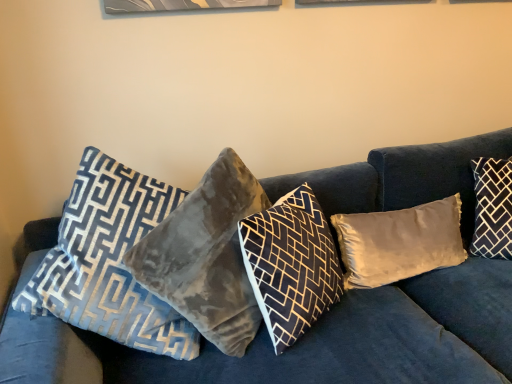
Question: From a real-world perspective, is velvet blue pillow at left, which is the 5th pillow in right-to-left order, physically above satin beige pillow at center, which appears as the fourth pillow when viewed from the left?

Choices:
 (A) no
 (B) yes

Answer: (B)

Question: Does velvet blue pillow at left, which is the 5th pillow in right-to-left order, have a greater height compared to satin beige pillow at center, which is counted as the 2th pillow, starting from the right?

Choices:
 (A) yes
 (B) no

Answer: (A)

Question: Is velvet blue pillow at left, which is the 5th pillow in right-to-left order, looking in the opposite direction of satin beige pillow at center, which is counted as the 2th pillow, starting from the right?

Choices:
 (A) yes
 (B) no

Answer: (B)

Question: Considering the relative positions of velvet blue pillow at left, which is the 5th pillow in right-to-left order, and satin beige pillow at center, which is counted as the 2th pillow, starting from the right, in the image provided, is velvet blue pillow at left, which is the 5th pillow in right-to-left order, to the right of satin beige pillow at center, which is counted as the 2th pillow, starting from the right, from the viewer's perspective?

Choices:
 (A) yes
 (B) no

Answer: (B)

Question: Does velvet blue pillow at left, which appears as the first pillow when viewed from the left, have a smaller size compared to satin beige pillow at center, which appears as the fourth pillow when viewed from the left?

Choices:
 (A) yes
 (B) no

Answer: (B)

Question: Would you say velvet blue pillow at left, which is the 5th pillow in right-to-left order, is outside satin beige pillow at center, which is counted as the 2th pillow, starting from the right?

Choices:
 (A) yes
 (B) no

Answer: (A)

Question: From a real-world perspective, is velvet gray pillow at center, the 3th pillow viewed from the right, below velvet blue couch at center?

Choices:
 (A) yes
 (B) no

Answer: (B)

Question: Is velvet gray pillow at center, the 3th pillow viewed from the left, at the right side of velvet blue couch at center?

Choices:
 (A) yes
 (B) no

Answer: (B)

Question: From the image's perspective, would you say velvet gray pillow at center, the 3th pillow viewed from the right, is shown under velvet blue couch at center?

Choices:
 (A) no
 (B) yes

Answer: (A)

Question: Is velvet gray pillow at center, the 3th pillow viewed from the left, wider than velvet blue couch at center?

Choices:
 (A) yes
 (B) no

Answer: (B)

Question: From a real-world perspective, is velvet gray pillow at center, the 3th pillow viewed from the left, on velvet blue couch at center?

Choices:
 (A) no
 (B) yes

Answer: (B)

Question: Is velvet blue couch at center inside velvet gray pillow at center, the 3th pillow viewed from the right?

Choices:
 (A) yes
 (B) no

Answer: (B)

Question: Is the position of velvet blue couch at center less distant than that of satin beige pillow at center, which appears as the fourth pillow when viewed from the left?

Choices:
 (A) yes
 (B) no

Answer: (A)